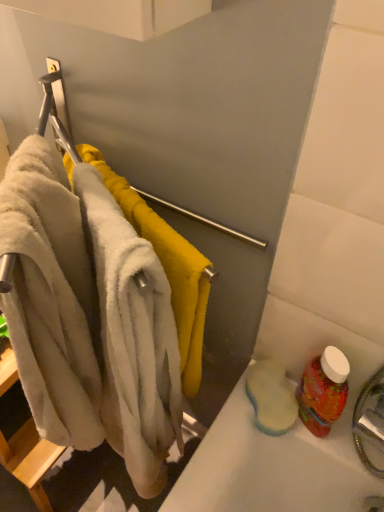
Question: From the image's perspective, is red plastic bottle at lower right positioned above or below soft white towel at left?

Choices:
 (A) below
 (B) above

Answer: (A)

Question: From a real-world perspective, is red plastic bottle at lower right positioned above or below soft white towel at left?

Choices:
 (A) below
 (B) above

Answer: (A)

Question: Which object is the farthest from the beige fluffy bath towel at left?

Choices:
 (A) red plastic bottle at lower right
 (B) soft white towel at left

Answer: (A)

Question: Estimate the real-world distances between objects in this image. Which object is farther from the soft white towel at left?

Choices:
 (A) beige fluffy bath towel at left
 (B) red plastic bottle at lower right

Answer: (B)